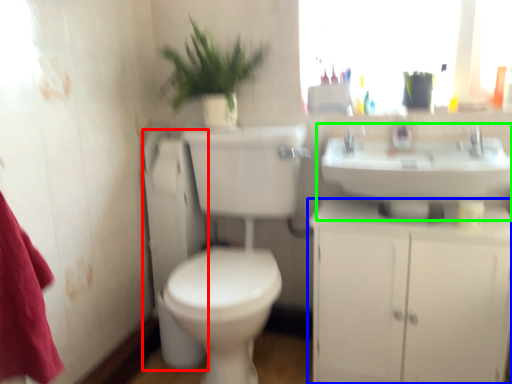
Question: Which object is positioned farthest from appliance (highlighted by a red box)? Select from bathroom cabinet (highlighted by a blue box) and sink (highlighted by a green box).

Choices:
 (A) bathroom cabinet
 (B) sink

Answer: (B)